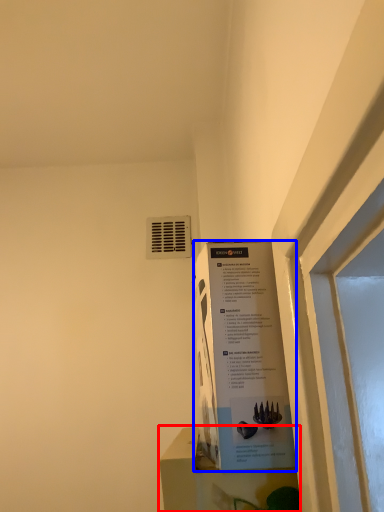
Question: Which of the following is the closest to the observer, window sill (highlighted by a red box) or poster (highlighted by a blue box)?

Choices:
 (A) window sill
 (B) poster

Answer: (A)